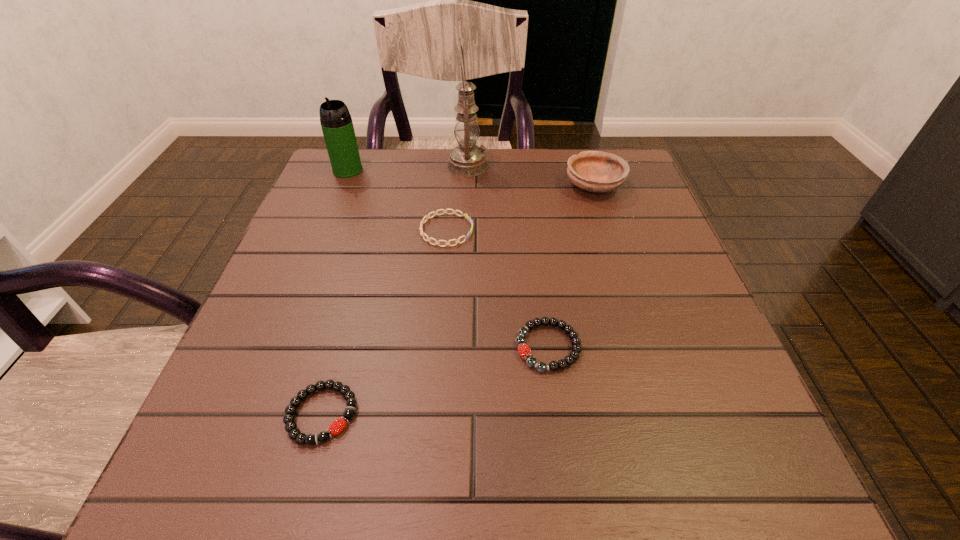
Locate an element on the screen. the second bracelet from left to right is located at coordinates (444, 211).

Where is `free space located on the left of the oil lamp`? The width and height of the screenshot is (960, 540). free space located on the left of the oil lamp is located at coordinates (390, 166).

The height and width of the screenshot is (540, 960). I want to click on free location located 0.210m from the spout of the second tallest object, so click(x=324, y=232).

Find the location of a particular element. The width and height of the screenshot is (960, 540). vacant region located 0.090m on the left of the bowl is located at coordinates (528, 186).

Locate an element on the screen. The image size is (960, 540). free spot located 0.090m on the left of the fifth farthest object is located at coordinates (462, 347).

The height and width of the screenshot is (540, 960). Identify the location of free point located on the right of the second object from left to right. (498, 414).

I want to click on free location located on the surface of the second bracelet from left to right showing star-shaped elements, so click(556, 230).

You are a GUI agent. You are given a task and a screenshot of the screen. Output one action in this format:
    pyautogui.click(x=<x>, y=<y>)
    Task: Click on the oil lamp present at the far edge
    
    Given the screenshot: What is the action you would take?
    pyautogui.click(x=467, y=159)

This screenshot has height=540, width=960. Identify the location of thermos bottle that is at the far edge. (336, 122).

What are the coordinates of `bowl present at the far edge` in the screenshot? It's located at (595, 171).